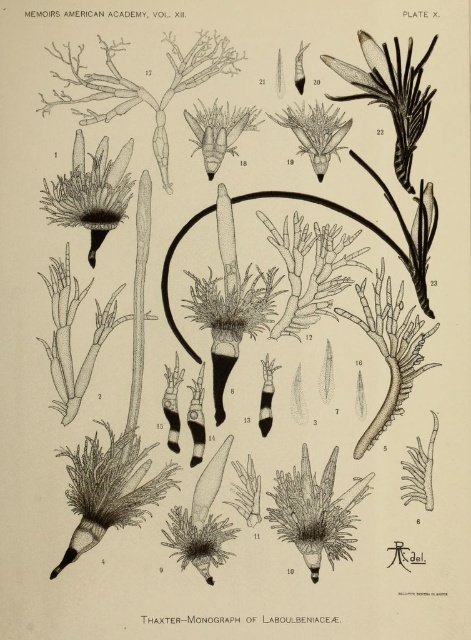
Based on the botanical illustration from the Memoirs American Academy, you are an entomologist examining the plant structure. You notice two flowers labeled dark brown textured flower at upper left and dark green textured flower at center. Which flower is positioned lower in the illustration?

The dark brown textured flower at upper left is positioned below the dark green textured flower at center, so the dark brown textured flower at upper left is lower in the illustration.

Looking at the botanical illustration from the Memoirs American Academy, you notice two flowers labeled as dark brown textured flower at upper left and dark green textured flower at center. Which of these two flowers has a greater width?

The dark brown textured flower at upper left has a greater width than the dark green textured flower at center.